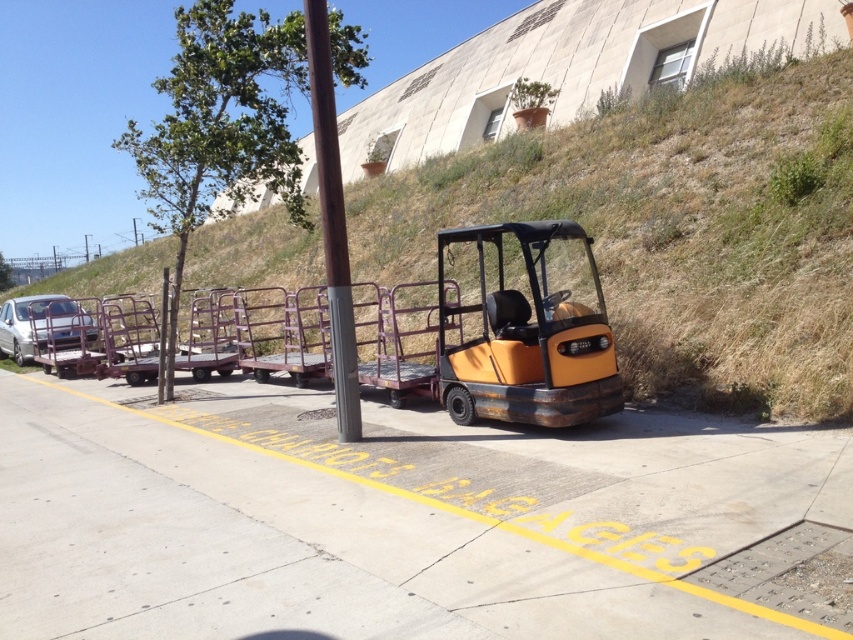
You are a delivery driver who needs to park your truck in this parking area. You see the orange metallic forklift at center and the silver metallic car at left. Which vehicle is taller and might block the entrance to the parking area?

The orange metallic forklift at center is taller than the silver metallic car at left, so it might block the entrance to the parking area.

Looking at this image, you are standing at the center of the parking area and want to locate the orange matte forklift at center. According to the coordinates provided, in which direction should you move to find it?

The orange matte forklift at center is located at coordinates point [531,332], so you should move towards the right side of the frame to find it since the x coordinate is slightly above 0.5.